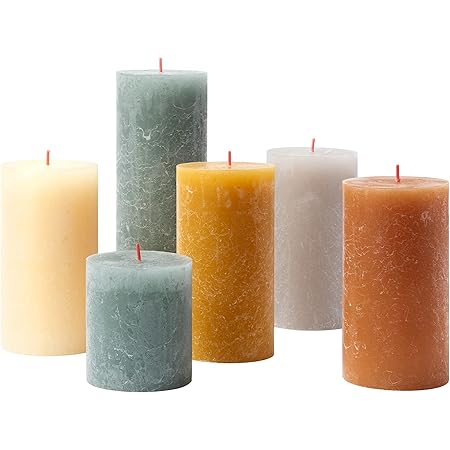
The width and height of the screenshot is (450, 450). Find the location of `candles`. candles is located at coordinates (60, 215), (160, 141), (139, 298), (219, 248), (313, 225), (393, 243).